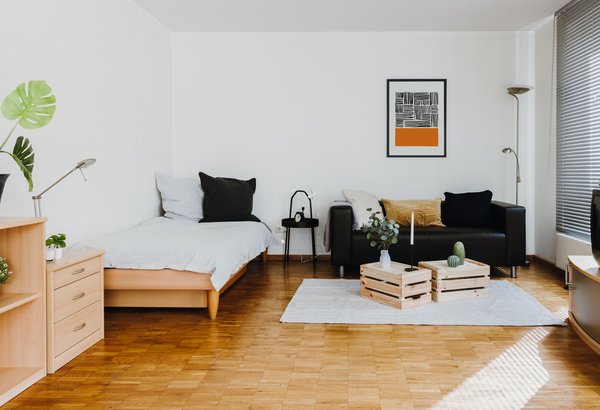
The image size is (600, 410). I want to click on dresser, so click(x=73, y=295).